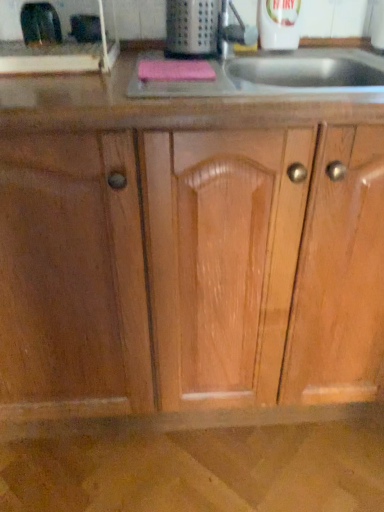
Question: From a real-world perspective, does black rubber gloves at upper left, the first appliance viewed from the left, stand above metallic silver toaster at upper left, the second appliance from the left?

Choices:
 (A) yes
 (B) no

Answer: (A)

Question: From the image's perspective, is black rubber gloves at upper left, the first appliance viewed from the left, on top of metallic silver toaster at upper left, which appears as the 2th appliance when viewed from the right?

Choices:
 (A) yes
 (B) no

Answer: (B)

Question: Does black rubber gloves at upper left, the first appliance viewed from the left, contain metallic silver toaster at upper left, the second appliance from the left?

Choices:
 (A) no
 (B) yes

Answer: (A)

Question: From the image's perspective, is black rubber gloves at upper left, the first appliance viewed from the left, under metallic silver toaster at upper left, which appears as the 2th appliance when viewed from the right?

Choices:
 (A) yes
 (B) no

Answer: (A)

Question: Can you confirm if black rubber gloves at upper left, the first appliance viewed from the left, is bigger than metallic silver toaster at upper left, the second appliance from the left?

Choices:
 (A) no
 (B) yes

Answer: (A)

Question: In terms of size, does metallic silver toaster at upper left, which appears as the 2th appliance when viewed from the right, appear bigger or smaller than pink fabric sponge at upper center?

Choices:
 (A) small
 (B) big

Answer: (A)

Question: Do you think metallic silver toaster at upper left, the second appliance from the left, is within pink fabric sponge at upper center, or outside of it?

Choices:
 (A) inside
 (B) outside

Answer: (B)

Question: From the image's perspective, is metallic silver toaster at upper left, the second appliance from the left, located above or below pink fabric sponge at upper center?

Choices:
 (A) above
 (B) below

Answer: (A)

Question: From a real-world perspective, is metallic silver toaster at upper left, the second appliance from the left, above or below pink fabric sponge at upper center?

Choices:
 (A) below
 (B) above

Answer: (B)

Question: In the image, is metallic silver toaster at upper left, the second appliance from the left, on the left side or the right side of black rubber gloves at upper left, the first appliance viewed from the left?

Choices:
 (A) right
 (B) left

Answer: (A)

Question: From a real-world perspective, is metallic silver toaster at upper left, which appears as the 2th appliance when viewed from the right, positioned above or below black rubber gloves at upper left, the 3th appliance viewed from the right?

Choices:
 (A) below
 (B) above

Answer: (A)

Question: In the image, is metallic silver toaster at upper left, the second appliance from the left, positioned in front of or behind black rubber gloves at upper left, the first appliance viewed from the left?

Choices:
 (A) behind
 (B) front

Answer: (A)

Question: Considering the positions of metallic silver toaster at upper left, which appears as the 2th appliance when viewed from the right, and black rubber gloves at upper left, the 3th appliance viewed from the right, in the image, is metallic silver toaster at upper left, which appears as the 2th appliance when viewed from the right, wider or thinner than black rubber gloves at upper left, the 3th appliance viewed from the right,?

Choices:
 (A) thin
 (B) wide

Answer: (B)

Question: In the image, is black rubber gloves at upper left, the first appliance viewed from the left, on the left side or the right side of metallic grater at upper center, which appears as the third appliance when viewed from the left?

Choices:
 (A) right
 (B) left

Answer: (B)

Question: Considering their positions, is black rubber gloves at upper left, the 3th appliance viewed from the right, located in front of or behind metallic grater at upper center, acting as the 1th appliance starting from the right?

Choices:
 (A) behind
 (B) front

Answer: (A)